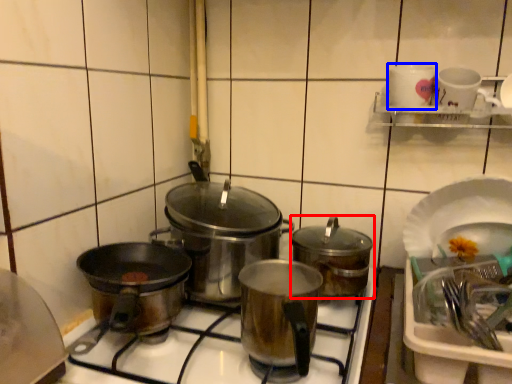
Question: Which of the following is the closest to the observer, kitchen appliance (highlighted by a red box) or tableware (highlighted by a blue box)?

Choices:
 (A) kitchen appliance
 (B) tableware

Answer: (A)